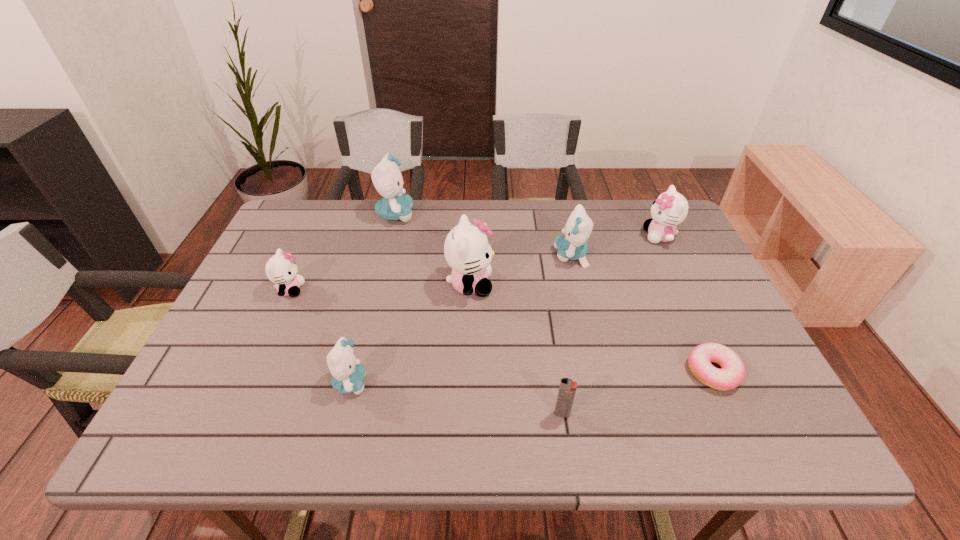
Image resolution: width=960 pixels, height=540 pixels. I want to click on free space between the pink doughnut and the farthest white kitten, so click(686, 303).

Identify the location of free space between the biggest blue kitten and the igniter. (479, 314).

Find the location of `free space that is in between the rightmost white kitten and the biggest blue kitten`. free space that is in between the rightmost white kitten and the biggest blue kitten is located at coordinates (528, 225).

The height and width of the screenshot is (540, 960). Identify the location of unoccupied area between the nearest blue kitten and the biggest blue kitten. (373, 299).

Find the location of a particular element. The height and width of the screenshot is (540, 960). empty space between the second biggest white kitten and the nearest kitten is located at coordinates [505, 309].

Identify the location of unoccupied position between the rightmost white kitten and the nearest blue kitten. The image size is (960, 540). (505, 309).

You are a GUI agent. You are given a task and a screenshot of the screen. Output one action in this format:
    pyautogui.click(x=<x>, y=<y>)
    Task: Click on the vacant space that's between the rightmost kitten and the igniter
    This screenshot has height=540, width=960.
    Given the screenshot: What is the action you would take?
    pyautogui.click(x=611, y=325)

I want to click on vacant space that is in between the nearest kitten and the farthest white kitten, so click(x=505, y=309).

The image size is (960, 540). I want to click on vacant space that is in between the biggest white kitten and the second farthest blue kitten, so click(x=520, y=270).

Identify which object is the second closest to the nearest blue kitten. Please provide its 2D coordinates. Your answer should be formatted as a tuple, i.e. [(x, y)], where the tuple contains the x and y coordinates of a point satisfying the conditions above.

[(281, 269)]